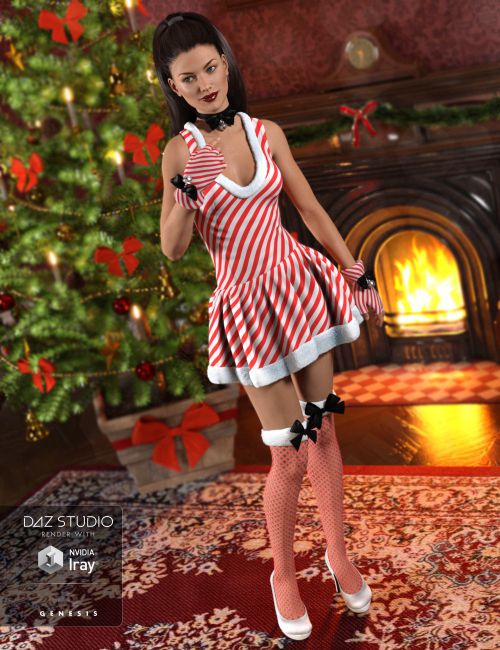
Image resolution: width=500 pixels, height=650 pixels. In order to click on candles in this screenshot , I will do (x=71, y=112), (x=137, y=325), (x=134, y=20), (x=55, y=268), (x=121, y=171).